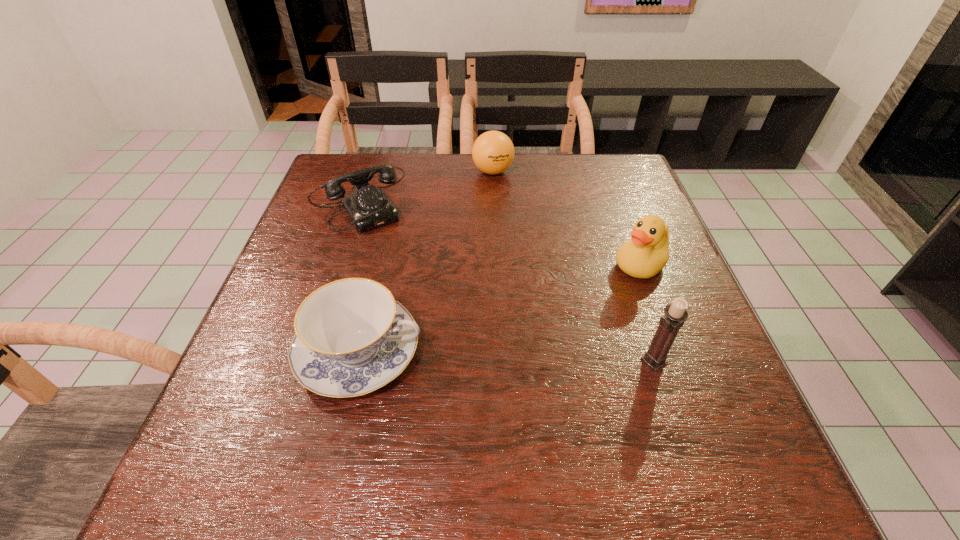
This screenshot has height=540, width=960. Find the location of `free space on the desktop that is between the chinaware and the candle holder and is positioned on the side with brand of the third object from left to right`. free space on the desktop that is between the chinaware and the candle holder and is positioned on the side with brand of the third object from left to right is located at coordinates (478, 355).

Where is `free spot on the desktop that is between the chinaware and the candle holder and is positioned on the front-facing side of the telephone`? The image size is (960, 540). free spot on the desktop that is between the chinaware and the candle holder and is positioned on the front-facing side of the telephone is located at coordinates (467, 355).

Locate an element on the screen. The height and width of the screenshot is (540, 960). free space on the desktop that is between the chinaware and the candle holder and is positioned at the beak of the duck is located at coordinates (528, 357).